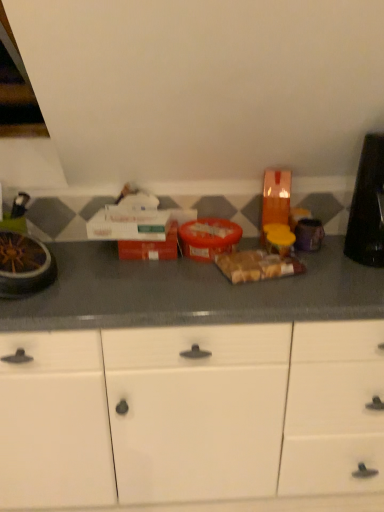
The image size is (384, 512). I want to click on blank space situated above white matte cabinet at center (from a real-world perspective), so click(221, 274).